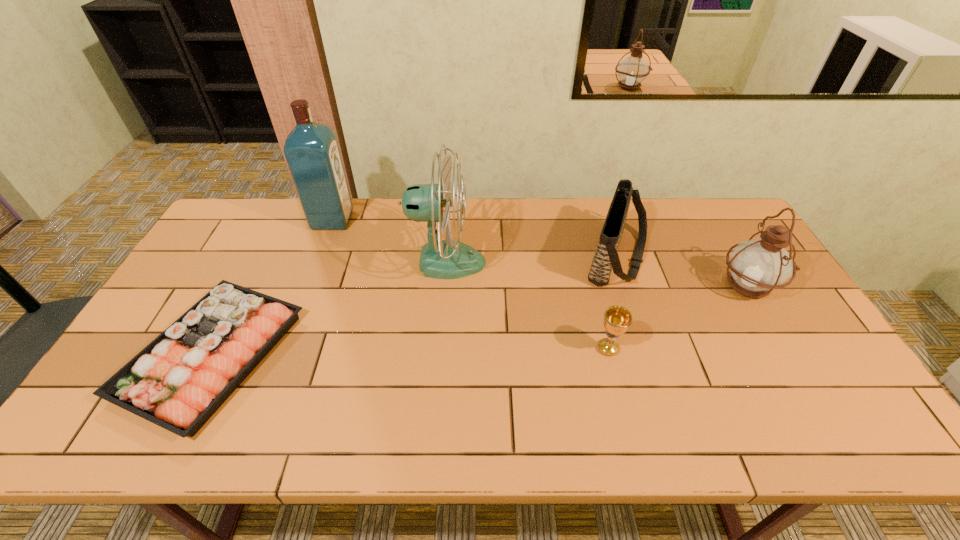
This screenshot has height=540, width=960. What are the coordinates of `liquor` in the screenshot? It's located at (311, 149).

The width and height of the screenshot is (960, 540). In order to click on the fourth object from right to left in this screenshot , I will do (x=441, y=259).

Image resolution: width=960 pixels, height=540 pixels. Identify the location of oil lamp. (757, 266).

Find the location of a particular element. the fourth shortest object is located at coordinates (x=757, y=266).

At what (x,y) coordinates should I click in order to perform the action: click on handbag. Please return your answer as a coordinate pair (x, y). Looking at the image, I should click on (606, 258).

Locate an element on the screen. The width and height of the screenshot is (960, 540). the second shortest object is located at coordinates (617, 319).

Identify the location of platter. (208, 352).

Find the location of a particular element. This screenshot has height=540, width=960. vacant space located 0.150m on the flat label side of the liquor is located at coordinates (394, 220).

You are a GUI agent. You are given a task and a screenshot of the screen. Output one action in this format:
    pyautogui.click(x=<x>, y=<y>)
    Task: Click on the free space located 0.060m in front of the third object from left to right, directing airflow
    The height and width of the screenshot is (540, 960).
    Given the screenshot: What is the action you would take?
    pyautogui.click(x=505, y=262)

Identify the location of vacant position located 0.300m on the back of the third tallest object. The width and height of the screenshot is (960, 540). (702, 208).